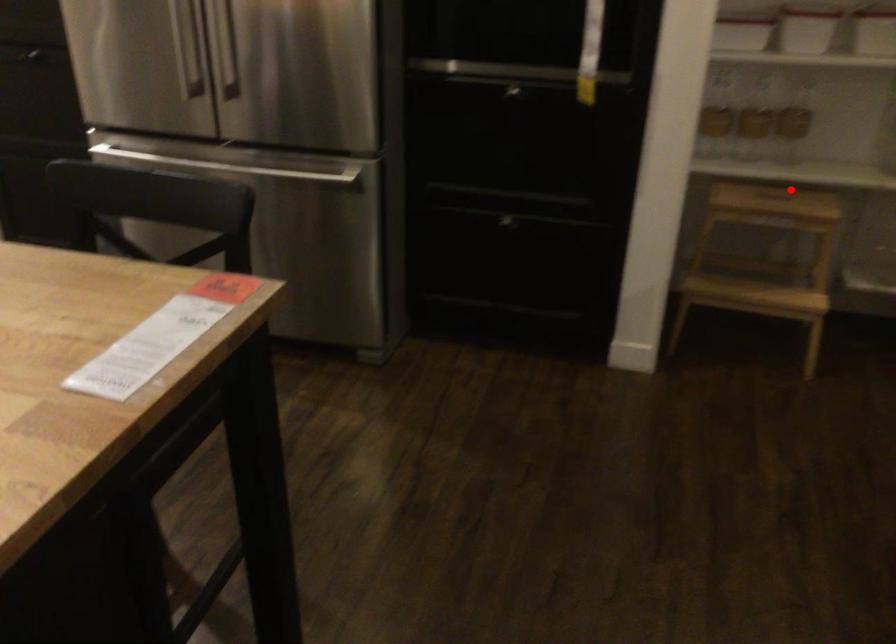
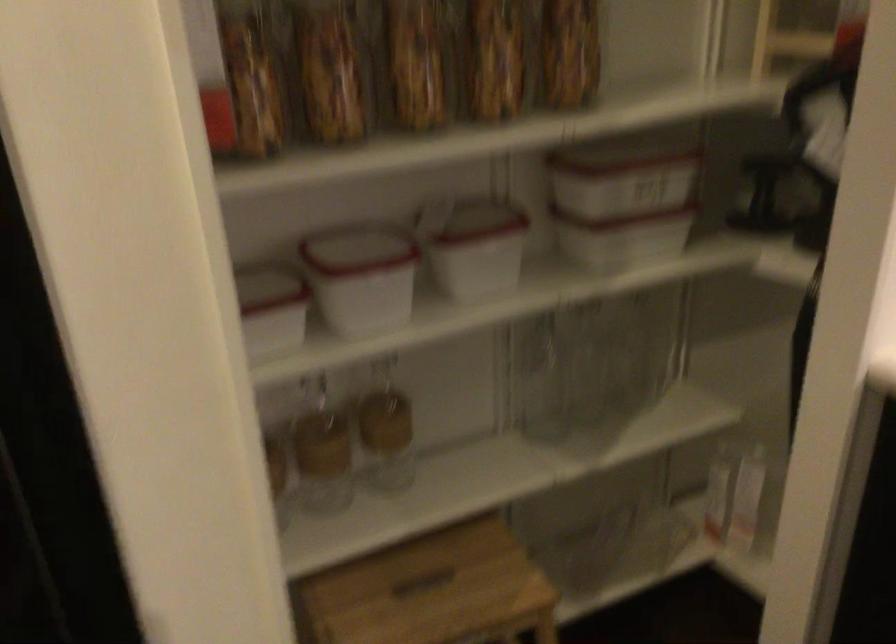
Question: I am providing you with two images of the same scene from different viewpoints. In image1, a red point is highlighted. Considering the same 3D point in image2, which of the following is correct?

Choices:
 (A) It is closer
 (B) It is farther

Answer: (A)